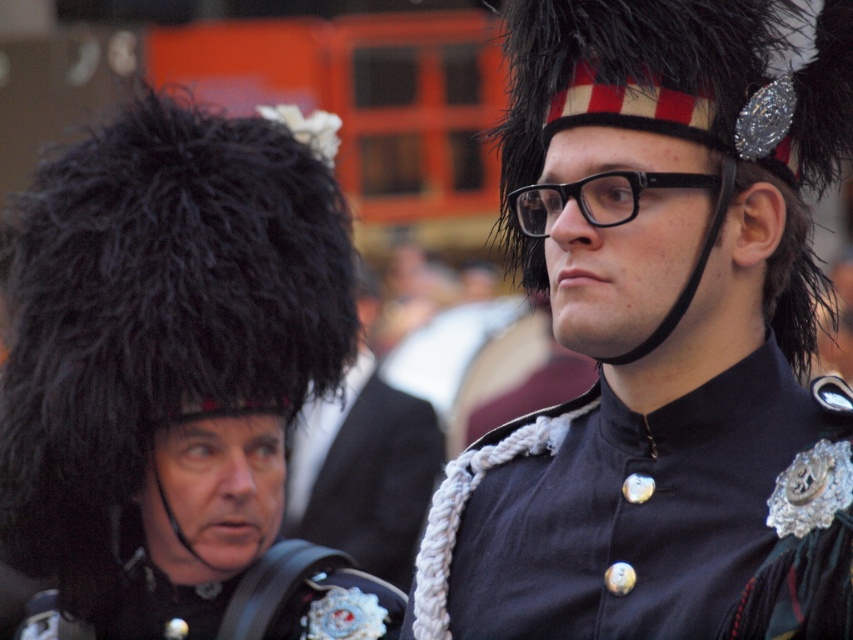
You are a photographer standing 10 meters away from the camera. You want to take a photo of the black fabric uniform at center. Can you reach the camera in time to capture the moment?

The black fabric uniform at center and camera are 11.38 meters apart from each other. Since you are already 10 meters away from the camera, you are only 1.38 meters away from the black fabric uniform at center. Therefore, you can easily reach the camera to capture the moment.

Based on the photo, you are a costume designer preparing for a historical play. You have two items from the scene described. The first is the black fuzzy hat at left, and the second is the black fabric uniform at center. Based on their sizes, which item would require more fabric to create?

The black fuzzy hat at left requires more fabric because its width is larger than the black fabric uniform at center.

Based on the coordinates provided, which object is located at point (173, 376) in the image?

The point (173, 376) corresponds to the black fuzzy hat at left.